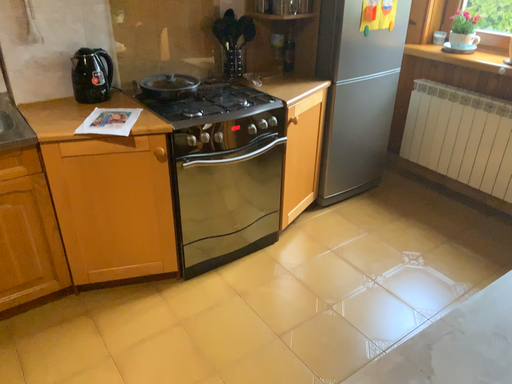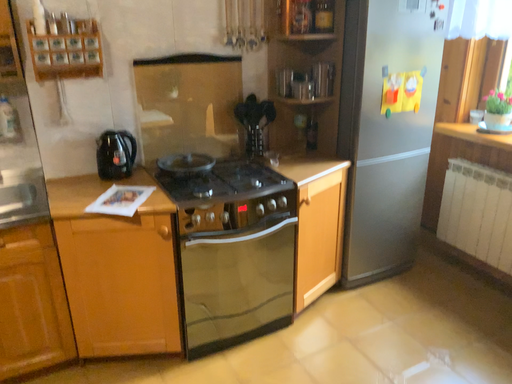
Question: How did the camera likely rotate when shooting the video?

Choices:
 (A) rotated left
 (B) rotated right

Answer: (A)